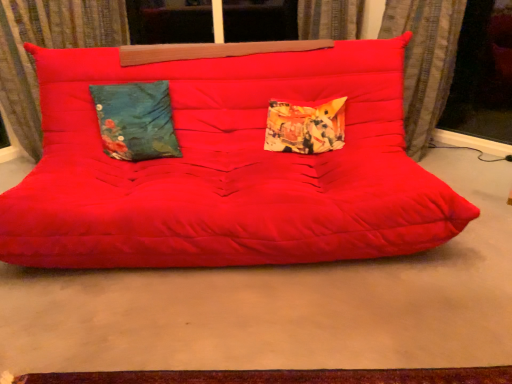
Question: Is the depth of printed fabric pillow at center, which ranks as the 2th pillow in left-to-right order, less than that of transparent glass window screen at right?

Choices:
 (A) yes
 (B) no

Answer: (A)

Question: From a real-world perspective, is printed fabric pillow at center, which appears as the 1th pillow when viewed from the right, over transparent glass window screen at right?

Choices:
 (A) no
 (B) yes

Answer: (A)

Question: Could you tell me if printed fabric pillow at center, which ranks as the 2th pillow in left-to-right order, is turned towards transparent glass window screen at right?

Choices:
 (A) yes
 (B) no

Answer: (B)

Question: Is printed fabric pillow at center, which appears as the 1th pillow when viewed from the right, oriented away from transparent glass window screen at right?

Choices:
 (A) yes
 (B) no

Answer: (B)

Question: Considering the relative sizes of printed fabric pillow at center, which appears as the 1th pillow when viewed from the right, and transparent glass window screen at right in the image provided, is printed fabric pillow at center, which appears as the 1th pillow when viewed from the right, thinner than transparent glass window screen at right?

Choices:
 (A) no
 (B) yes

Answer: (A)

Question: Considering the positions of matte red studio couch at center and matte red futon at center in the image, is matte red studio couch at center taller or shorter than matte red futon at center?

Choices:
 (A) short
 (B) tall

Answer: (B)

Question: Is matte red studio couch at center to the left or to the right of matte red futon at center in the image?

Choices:
 (A) right
 (B) left

Answer: (B)

Question: From the image's perspective, is matte red studio couch at center positioned above or below matte red futon at center?

Choices:
 (A) above
 (B) below

Answer: (A)

Question: Based on their sizes in the image, would you say matte red studio couch at center is bigger or smaller than matte red futon at center?

Choices:
 (A) small
 (B) big

Answer: (B)

Question: Choose the correct answer: Is matte red futon at center inside velvet curtain at upper left, placed as the 2th curtain when sorted from right to left, or outside it?

Choices:
 (A) inside
 (B) outside

Answer: (B)

Question: From a real-world perspective, is matte red futon at center positioned above or below velvet curtain at upper left, the 1th curtain when ordered from left to right?

Choices:
 (A) below
 (B) above

Answer: (A)

Question: Looking at the image, does matte red futon at center seem bigger or smaller compared to velvet curtain at upper left, placed as the 2th curtain when sorted from right to left?

Choices:
 (A) small
 (B) big

Answer: (B)

Question: Considering their positions, is matte red futon at center located in front of or behind velvet curtain at upper left, placed as the 2th curtain when sorted from right to left?

Choices:
 (A) front
 (B) behind

Answer: (A)

Question: Considering the positions of matte red futon at center and teal floral fabric pillow at left, acting as the second pillow starting from the right, in the image, is matte red futon at center wider or thinner than teal floral fabric pillow at left, acting as the second pillow starting from the right,?

Choices:
 (A) wide
 (B) thin

Answer: (A)

Question: From the image's perspective, is matte red futon at center located above or below teal floral fabric pillow at left, acting as the second pillow starting from the right?

Choices:
 (A) below
 (B) above

Answer: (A)